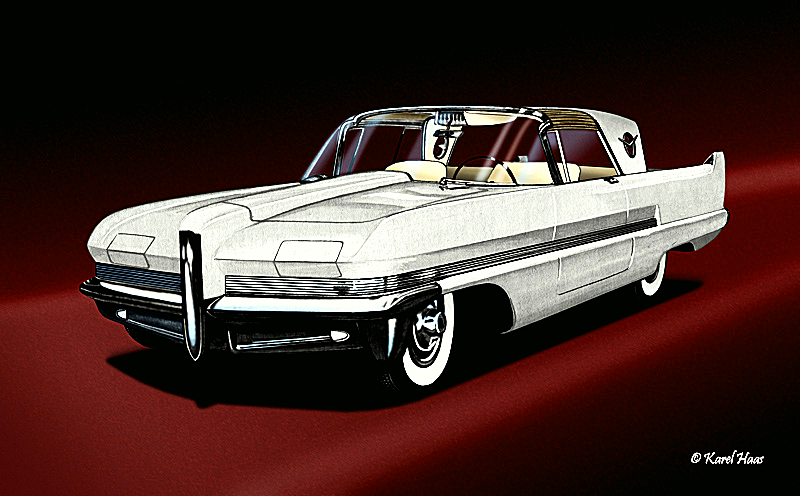
This screenshot has height=496, width=800. Identify the location of hood. (326, 195).